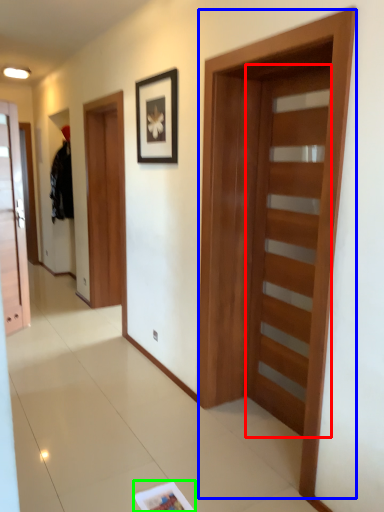
Question: Which object is positioned closest to door (highlighted by a red box)? Select from barn door (highlighted by a blue box) and magazine (highlighted by a green box).

Choices:
 (A) barn door
 (B) magazine

Answer: (A)